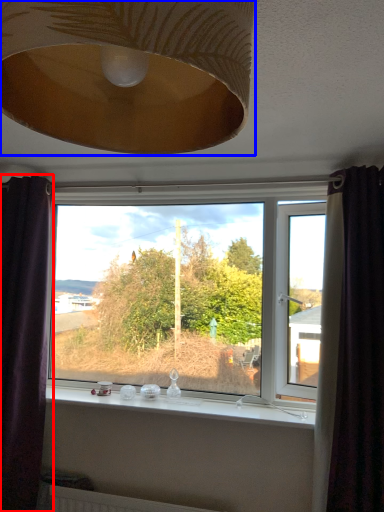
Question: Which of the following is the closest to the observer, curtain (highlighted by a red box) or lamp (highlighted by a blue box)?

Choices:
 (A) curtain
 (B) lamp

Answer: (B)